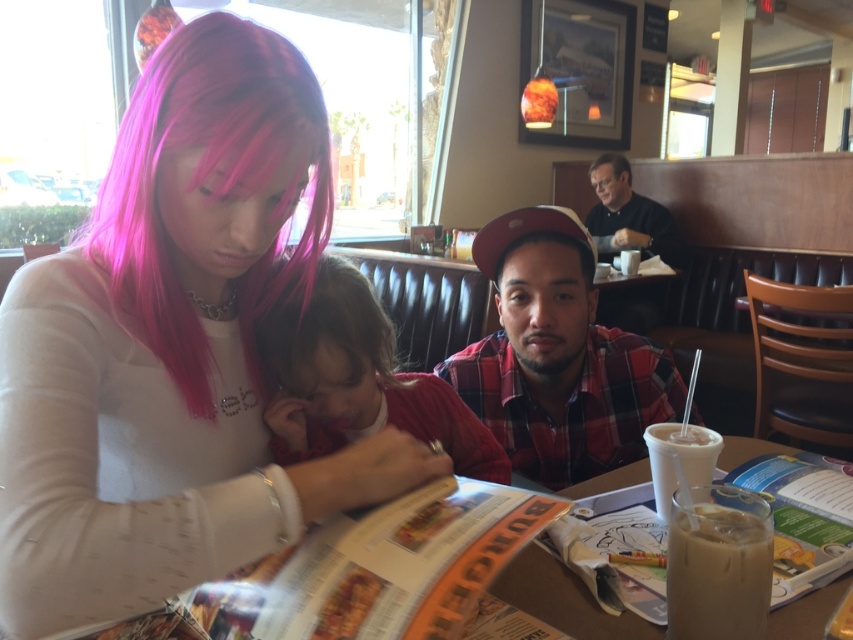
You are a waiter in a restaurant and need to deliver a drink to the customer seated near the black matte shirt at upper right. The drink is in the white frosted cup at right. Can you easily hand the drink to the customer without moving the cup? Explain why based on their positions.

The white frosted cup at right is behind the black matte shirt at upper right, so the waiter cannot easily hand the drink to the customer without moving the cup because it is positioned behind the shirt, making it inaccessible from the front.

You are a delivery person who needs to place a small package on the table between the matte plastic magazine at lower right and the dark brown hair at upper right. Can you fit the package there if it measures 1 foot in length?

The distance between the matte plastic magazine at lower right and the dark brown hair at upper right is 10.49 feet, so yes, the package measuring 1 foot in length can fit between them.